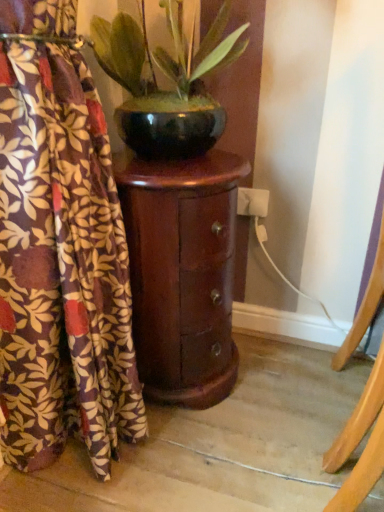
Find the location of `free space above shiny dark wood cabinet at center (from a real-world perspective)`. free space above shiny dark wood cabinet at center (from a real-world perspective) is located at coordinates (181, 159).